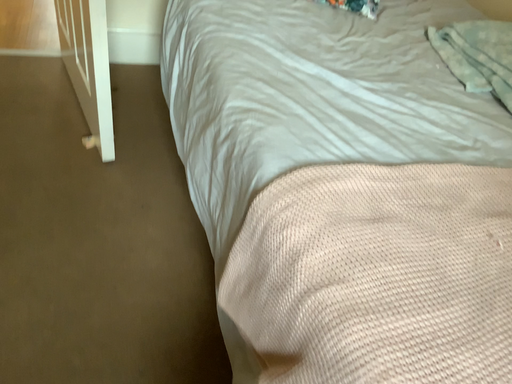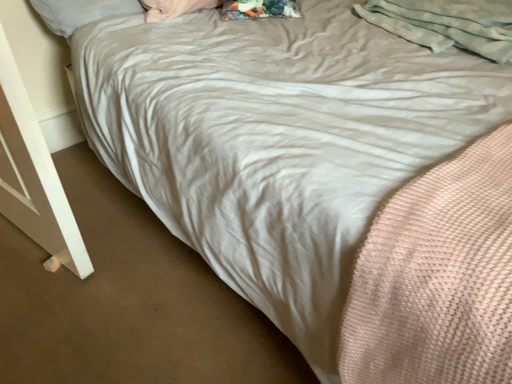
Question: Which way did the camera rotate in the video?

Choices:
 (A) rotated right
 (B) rotated left

Answer: (A)